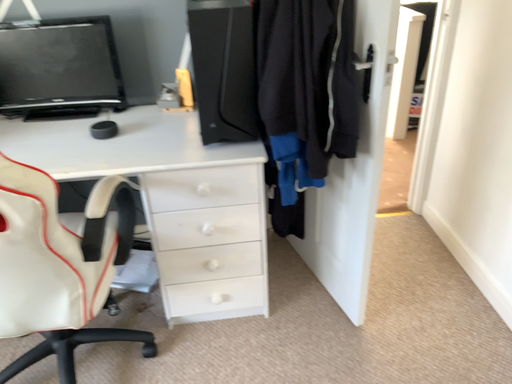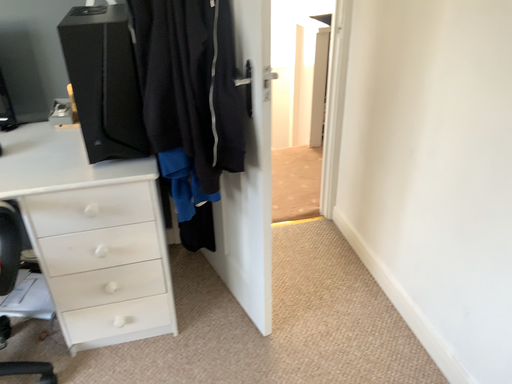
Question: How did the camera likely rotate when shooting the video?

Choices:
 (A) rotated left
 (B) rotated right

Answer: (B)